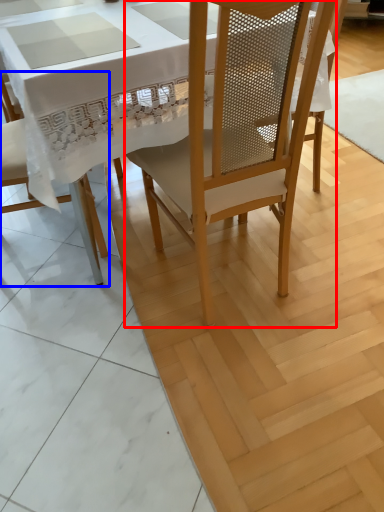
Question: Which object is further to the camera taking this photo, chair (highlighted by a red box) or chair (highlighted by a blue box)?

Choices:
 (A) chair
 (B) chair

Answer: (B)